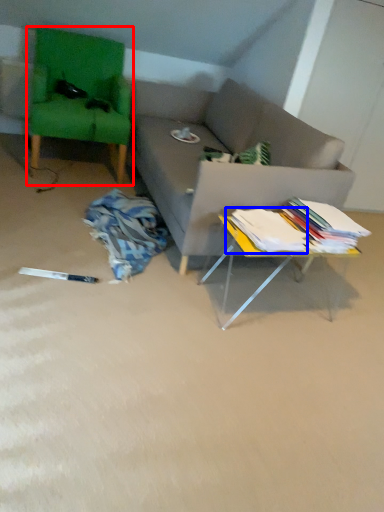
Question: Among these objects, which one is nearest to the camera, swivel chair (highlighted by a red box) or book (highlighted by a blue box)?

Choices:
 (A) swivel chair
 (B) book

Answer: (B)